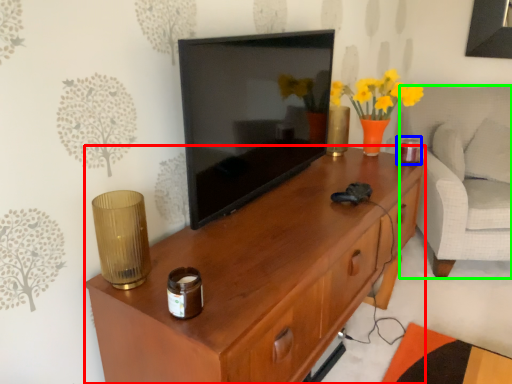
Question: Which object is positioned closest to desk (highlighted by a red box)? Select from candle holder (highlighted by a blue box) and armchair (highlighted by a green box).

Choices:
 (A) candle holder
 (B) armchair

Answer: (A)